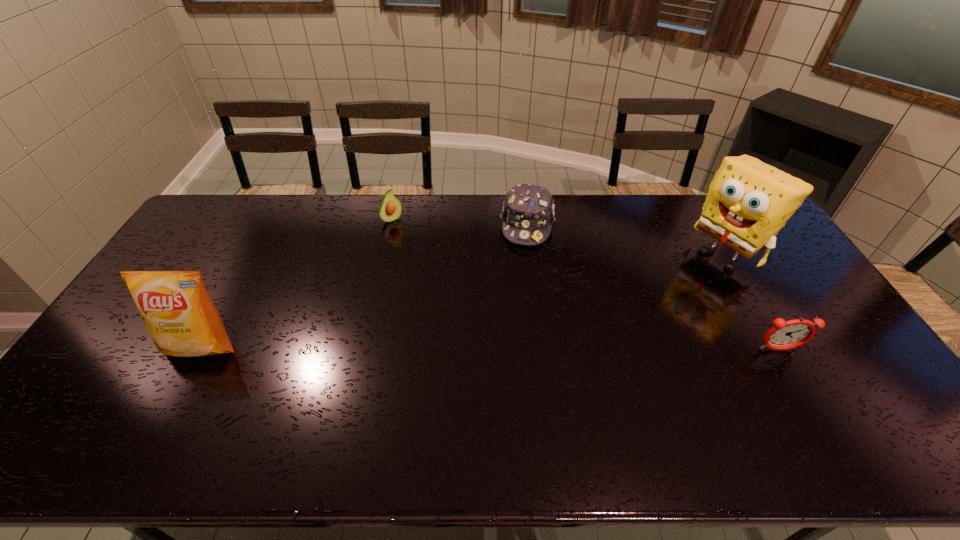
Where is `free spot on the desktop that is between the leftmost object and the alarm clock and is positioned on the cut side of the fourth object from right to left`? This screenshot has width=960, height=540. free spot on the desktop that is between the leftmost object and the alarm clock and is positioned on the cut side of the fourth object from right to left is located at coordinates (513, 348).

Identify the location of free space on the desktop that is between the crisp (potato chip) and the alarm clock and is positioned on the face of the sponge. (574, 349).

Find the location of a particular element. This screenshot has width=960, height=540. free spot on the desktop that is between the fourth shortest object and the alarm clock and is positioned on the front-facing side of the third object from right to left is located at coordinates (512, 348).